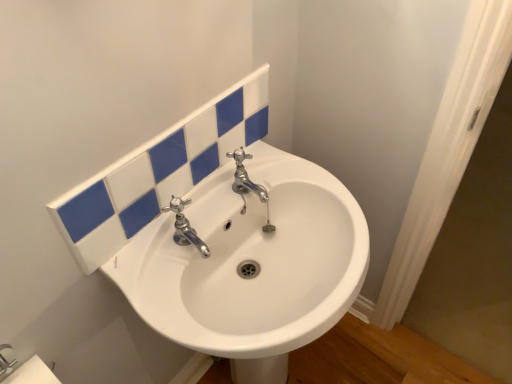
What do you see at coordinates (32, 373) in the screenshot? I see `white matte toilet paper at lower left` at bounding box center [32, 373].

The image size is (512, 384). What are the coordinates of `white matte toilet paper at lower left` in the screenshot? It's located at (32, 373).

The height and width of the screenshot is (384, 512). Find the location of `sink in front of the white glossy tiles at upper center`. sink in front of the white glossy tiles at upper center is located at coordinates (251, 264).

Considering the sizes of objects white glossy tiles at upper center and white glossy sink at center in the image provided, who is taller, white glossy tiles at upper center or white glossy sink at center?

Standing taller between the two is white glossy sink at center.

From a real-world perspective, is white glossy tiles at upper center over white glossy sink at center?

Correct, in the physical world, white glossy tiles at upper center is higher than white glossy sink at center.

Which object is further away from the camera, white glossy tiles at upper center or white glossy sink at center?

white glossy tiles at upper center is further from the camera.

Between white glossy sink at center and chrome/metallic faucet at center, which one has larger size?

white glossy sink at center.

From the image's perspective, relative to chrome/metallic faucet at center, is white glossy sink at center above or below?

white glossy sink at center is below chrome/metallic faucet at center.

Does white glossy sink at center have a lesser height compared to chrome/metallic faucet at center?

No, white glossy sink at center is not shorter than chrome/metallic faucet at center.

Is white glossy sink at center inside or outside of chrome/metallic faucet at center?

white glossy sink at center is not enclosed by chrome/metallic faucet at center.

From the image's perspective, who appears lower, white glossy sink at center or white matte toilet paper at lower left?

white glossy sink at center, from the image's perspective.

Is white glossy sink at center completely or partially outside of white matte toilet paper at lower left?

Yes, white glossy sink at center is located beyond the bounds of white matte toilet paper at lower left.

Considering the points (255, 195) and (58, 381), which point is in front, point (255, 195) or point (58, 381)?

Positioned in front is point (58, 381).

Measure the distance between white glossy tiles at upper center and chrome/metallic faucet at center.

A distance of 5.85 inches exists between white glossy tiles at upper center and chrome/metallic faucet at center.

Does white glossy tiles at upper center turn towards chrome/metallic faucet at center?

Yes, white glossy tiles at upper center is facing chrome/metallic faucet at center.

Considering the relative positions of white glossy tiles at upper center and chrome/metallic faucet at center in the image provided, is white glossy tiles at upper center to the left or to the right of chrome/metallic faucet at center?

In the image, white glossy tiles at upper center appears on the left side of chrome/metallic faucet at center.

How many degrees apart are the facing directions of white glossy tiles at upper center and chrome/metallic faucet at center?

3.16 degrees.

Is white matte toilet paper at lower left positioned in front of chrome/metallic faucet at center?

That is True.

Where is `toilet paper in front of the chrome/metallic faucet at center`? The image size is (512, 384). toilet paper in front of the chrome/metallic faucet at center is located at coordinates (32, 373).

Considering the sizes of objects white matte toilet paper at lower left and chrome/metallic faucet at center in the image provided, who is wider, white matte toilet paper at lower left or chrome/metallic faucet at center?

Wider between the two is chrome/metallic faucet at center.

Does point (42, 377) come closer to viewer compared to point (232, 119)?

Yes, point (42, 377) is closer to viewer.

Does white matte toilet paper at lower left appear on the left side of white glossy tiles at upper center?

Indeed, white matte toilet paper at lower left is positioned on the left side of white glossy tiles at upper center.

Looking at the image, does white matte toilet paper at lower left seem bigger or smaller compared to white glossy tiles at upper center?

Considering their sizes, white matte toilet paper at lower left takes up less space than white glossy tiles at upper center.

Is white glossy sink at center positioned with its back to white glossy tiles at upper center?

No, white glossy sink at center is not facing the opposite direction of white glossy tiles at upper center.

Considering the sizes of white glossy sink at center and white glossy tiles at upper center in the image, is white glossy sink at center bigger or smaller than white glossy tiles at upper center?

Considering their sizes, white glossy sink at center takes up more space than white glossy tiles at upper center.

Consider the image. Which is behind, white glossy sink at center or white glossy tiles at upper center?

white glossy tiles at upper center.

In order to click on tile on the left of white glossy sink at center in this screenshot , I will do `click(159, 172)`.

The image size is (512, 384). I want to click on sink directly beneath the chrome/metallic faucet at center (from a real-world perspective), so click(x=251, y=264).

Based on their spatial positions, is white matte toilet paper at lower left or chrome/metallic faucet at center further from white glossy sink at center?

white matte toilet paper at lower left is further to white glossy sink at center.

From the image, which object appears to be nearer to white glossy sink at center, white matte toilet paper at lower left or white glossy tiles at upper center?

white glossy tiles at upper center is closer to white glossy sink at center.

From the image, which object appears to be farther from chrome/metallic faucet at center, white matte toilet paper at lower left or white glossy tiles at upper center?

Answer: Among the two, white matte toilet paper at lower left is located further to chrome/metallic faucet at center.

Estimate the real-world distances between objects in this image. Which object is closer to chrome/metallic faucet at center, white glossy sink at center or white glossy tiles at upper center?

white glossy tiles at upper center.

Which object lies further to the anchor point white glossy tiles at upper center, chrome/metallic faucet at center or white glossy sink at center?

white glossy sink at center is further to white glossy tiles at upper center.

Estimate the real-world distances between objects in this image. Which object is closer to white glossy tiles at upper center, white glossy sink at center or chrome/metallic faucet at center?

chrome/metallic faucet at center is positioned closer to the anchor white glossy tiles at upper center.

Considering their positions, is white matte toilet paper at lower left positioned closer to chrome/metallic faucet at center than white glossy sink at center?

white glossy sink at center is positioned closer to the anchor chrome/metallic faucet at center.

Based on their spatial positions, is chrome/metallic faucet at center or white glossy tiles at upper center closer to white matte toilet paper at lower left?

The object closer to white matte toilet paper at lower left is chrome/metallic faucet at center.

Find the location of a particular element. This screenshot has height=384, width=512. tap that lies between white glossy tiles at upper center and white matte toilet paper at lower left from top to bottom is located at coordinates (185, 227).

Where is `toilet paper between white glossy tiles at upper center and white glossy sink at center from top to bottom`? The height and width of the screenshot is (384, 512). toilet paper between white glossy tiles at upper center and white glossy sink at center from top to bottom is located at coordinates (32, 373).

I want to click on tap situated between white matte toilet paper at lower left and white glossy sink at center from left to right, so click(185, 227).

Find the location of `tap between white glossy tiles at upper center and white glossy sink at center in the vertical direction`. tap between white glossy tiles at upper center and white glossy sink at center in the vertical direction is located at coordinates (185, 227).